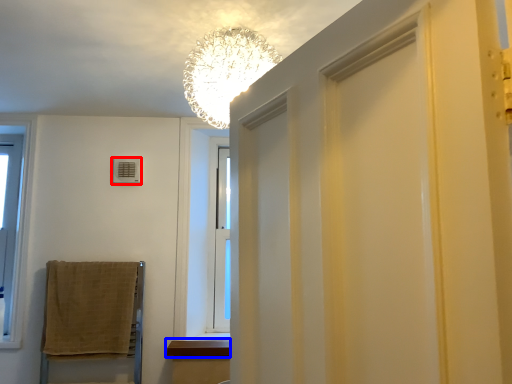
Question: Which object is further to the camera taking this photo, air conditioner (highlighted by a red box) or window sill (highlighted by a blue box)?

Choices:
 (A) air conditioner
 (B) window sill

Answer: (A)